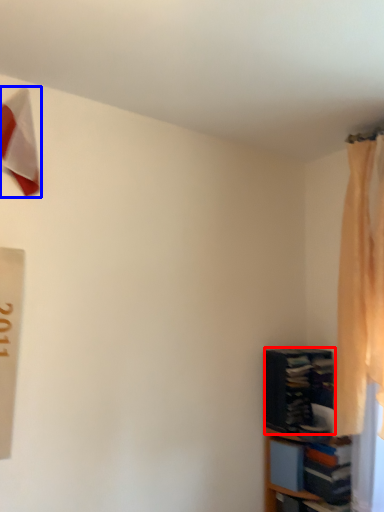
Question: Which object is further to the camera taking this photo, book (highlighted by a red box) or twin (highlighted by a blue box)?

Choices:
 (A) book
 (B) twin

Answer: (A)